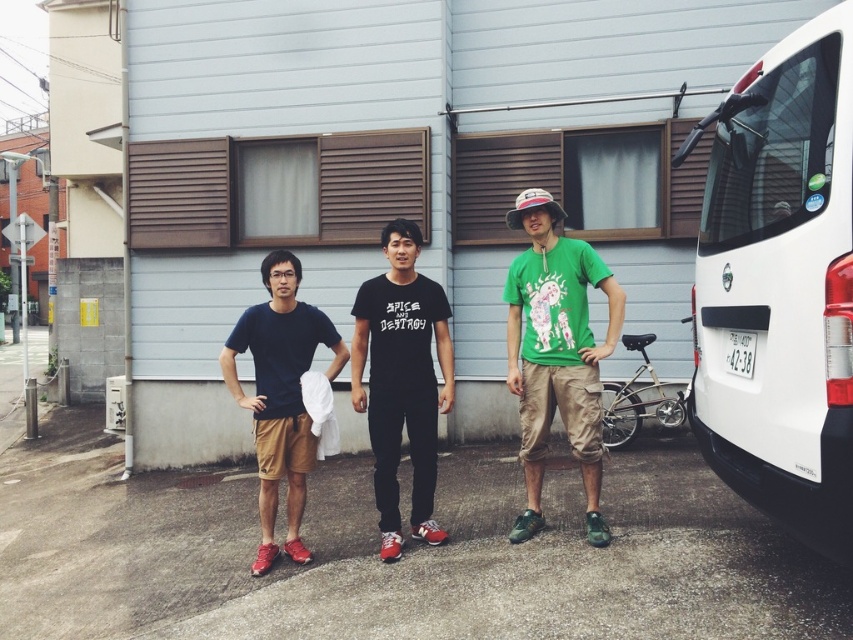
Question: Which of the following is the closest to the observer?

Choices:
 (A) (259, 380)
 (B) (744, 445)

Answer: (B)

Question: Is white matte van at right to the left of matte blue t-shirt at center from the viewer's perspective?

Choices:
 (A) no
 (B) yes

Answer: (A)

Question: Which point is closer to the camera taking this photo?

Choices:
 (A) (727, 458)
 (B) (434, 339)
 (C) (273, 525)

Answer: (A)

Question: Is white matte van at right further to camera compared to green cotton t-shirt at center?

Choices:
 (A) yes
 (B) no

Answer: (B)

Question: Which object appears closest to the camera in this image?

Choices:
 (A) black matte t-shirt at center
 (B) white matte van at right
 (C) matte blue t-shirt at center
 (D) green cotton t-shirt at center

Answer: (B)

Question: Is black matte t-shirt at center positioned in front of matte blue t-shirt at center?

Choices:
 (A) no
 (B) yes

Answer: (B)